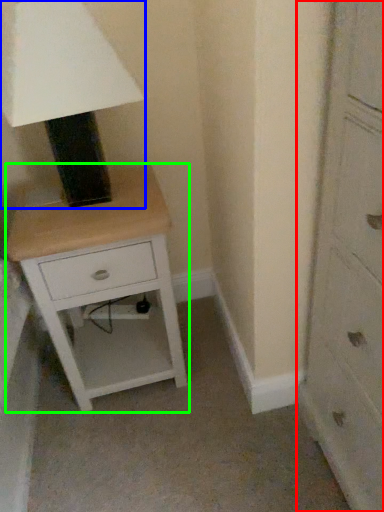
Question: Considering the real-world distances, which object is farthest from chest of drawers (highlighted by a red box)? table lamp (highlighted by a blue box) or nightstand (highlighted by a green box)?

Choices:
 (A) table lamp
 (B) nightstand

Answer: (A)